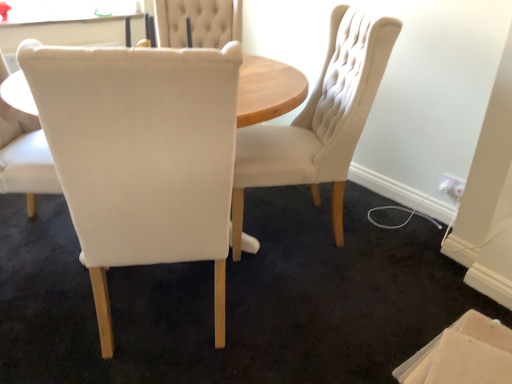
Locate an element on the screen. The image size is (512, 384). vacant point above beige cardboard box at lower right (from a real-world perspective) is located at coordinates (468, 360).